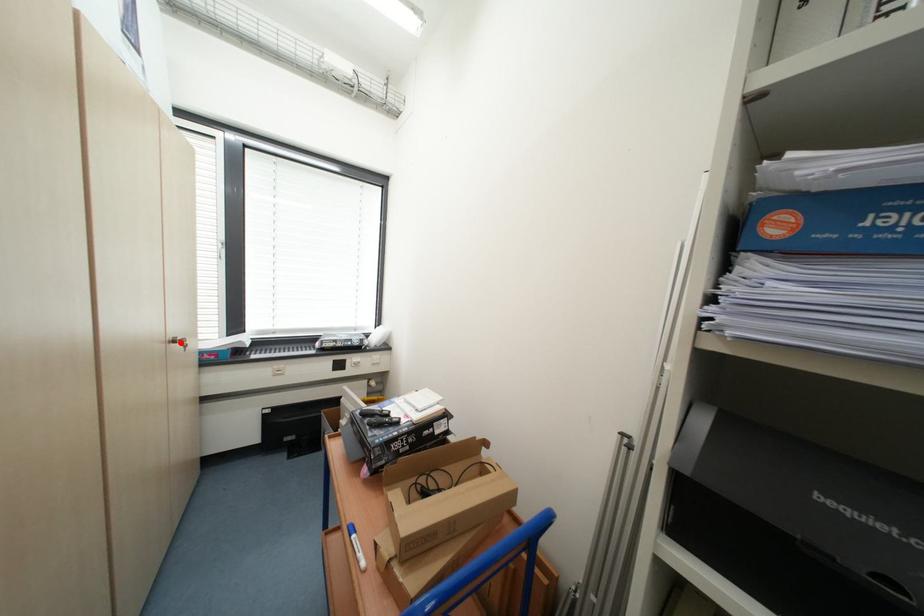
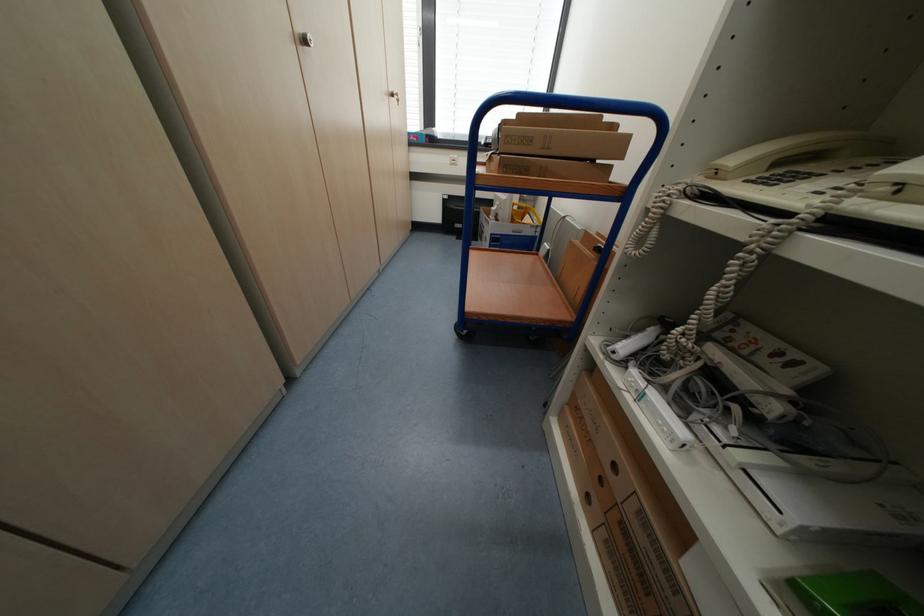
Find the pixel in the second image that matches the highlighted location in the first image.

(398, 95)